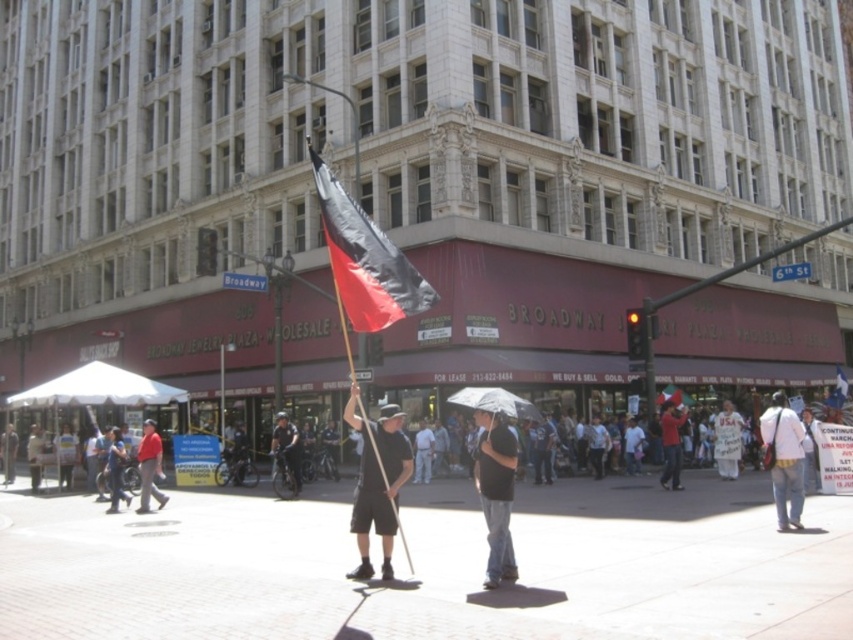
Can you confirm if matte black shorts at center is wider than red fabric umbrella at center?

Yes, matte black shorts at center is wider than red fabric umbrella at center.

Is matte black shorts at center shorter than red fabric umbrella at center?

No, matte black shorts at center is not shorter than red fabric umbrella at center.

Is point (352, 388) farther from viewer compared to point (676, 477)?

Yes.

Identify the location of matte black shorts at center. The height and width of the screenshot is (640, 853). (376, 483).

Which is more to the right, black fabric flag at center or transparent plastic umbrella at center?

transparent plastic umbrella at center is more to the right.

Can you confirm if black fabric flag at center is positioned to the left of transparent plastic umbrella at center?

Indeed, black fabric flag at center is positioned on the left side of transparent plastic umbrella at center.

The width and height of the screenshot is (853, 640). In order to click on black fabric flag at center in this screenshot , I will do `click(364, 260)`.

The width and height of the screenshot is (853, 640). I want to click on black fabric flag at center, so click(364, 260).

At what (x,y) coordinates should I click in order to perform the action: click on white cotton shirt at center. Please return your answer as a coordinate pair (x, y). The height and width of the screenshot is (640, 853). Looking at the image, I should click on (784, 460).

Is white cotton shirt at center smaller than red fabric umbrella at center?

No, white cotton shirt at center is not smaller than red fabric umbrella at center.

Does point (802, 456) come behind point (682, 419)?

No.

The width and height of the screenshot is (853, 640). I want to click on white cotton shirt at center, so click(784, 460).